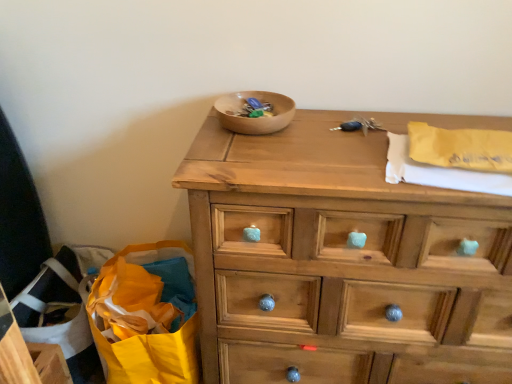
Question: Considering their positions, is wooden bowl at center located in front of or behind wooden chest of drawers at center?

Choices:
 (A) behind
 (B) front

Answer: (A)

Question: From the image's perspective, is wooden bowl at center above or below wooden chest of drawers at center?

Choices:
 (A) below
 (B) above

Answer: (B)

Question: Which object is positioned farthest from the wooden chest of drawers at center?

Choices:
 (A) wooden bowl at center
 (B) yellow paper at upper right
 (C) yellow paper bag at lower left

Answer: (C)

Question: Which object is positioned closest to the wooden bowl at center?

Choices:
 (A) yellow paper at upper right
 (B) wooden chest of drawers at center
 (C) yellow paper bag at lower left

Answer: (A)